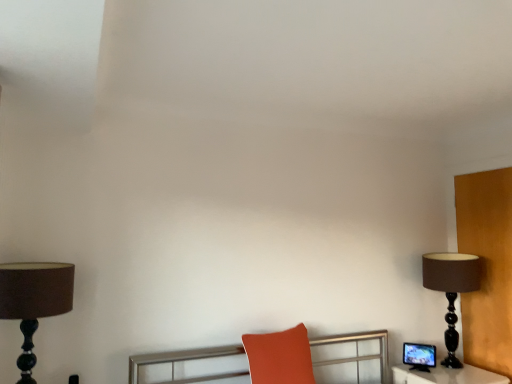
Question: Considering the positions of matte orange cushion at center and matte black monitor at right in the image, is matte orange cushion at center wider or thinner than matte black monitor at right?

Choices:
 (A) thin
 (B) wide

Answer: (B)

Question: From a real-world perspective, is matte orange cushion at center physically located above or below matte black monitor at right?

Choices:
 (A) above
 (B) below

Answer: (A)

Question: Estimate the real-world distances between objects in this image. Which object is farther from the matte orange cushion at center?

Choices:
 (A) brown fabric lampshade at left, placed as the 1th lamp when sorted from front to back
 (B) brown matte lamp at right, which appears as the second lamp when viewed from the left
 (C) matte black monitor at right

Answer: (A)

Question: Which object is positioned farthest from the matte orange cushion at center?

Choices:
 (A) brown fabric lampshade at left, positioned as the 2th lamp in back-to-front order
 (B) matte black monitor at right
 (C) brown matte lamp at right, placed as the 2th lamp when sorted from front to back

Answer: (A)